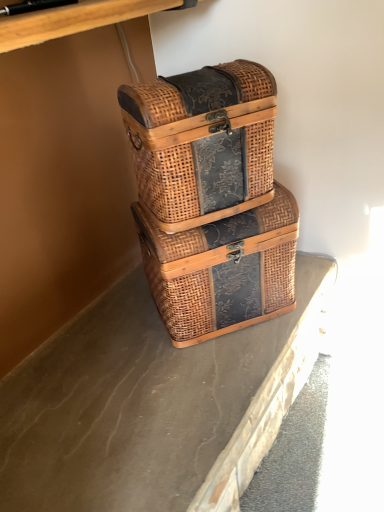
Question: Would you say woven wood picnic basket at center, which is the second picnic basket in bottom-to-top order, is outside brown textured concrete at center?

Choices:
 (A) yes
 (B) no

Answer: (A)

Question: From the image's perspective, is woven wood picnic basket at center, arranged as the first picnic basket when viewed from the top, located above brown textured concrete at center?

Choices:
 (A) no
 (B) yes

Answer: (B)

Question: Considering the relative sizes of woven wood picnic basket at center, which is the second picnic basket in bottom-to-top order, and brown textured concrete at center in the image provided, is woven wood picnic basket at center, which is the second picnic basket in bottom-to-top order, taller than brown textured concrete at center?

Choices:
 (A) yes
 (B) no

Answer: (A)

Question: Is the position of woven wood picnic basket at center, which is the second picnic basket in bottom-to-top order, less distant than that of brown textured concrete at center?

Choices:
 (A) no
 (B) yes

Answer: (A)

Question: Does woven wood picnic basket at center, arranged as the first picnic basket when viewed from the top, appear on the right side of brown textured concrete at center?

Choices:
 (A) no
 (B) yes

Answer: (B)

Question: From the image's perspective, is brown textured concrete at center located above or below woven brown picnic basket at center, which is the second picnic basket in top-to-bottom order?

Choices:
 (A) below
 (B) above

Answer: (A)

Question: From their relative heights in the image, would you say brown textured concrete at center is taller or shorter than woven brown picnic basket at center, which is the second picnic basket in top-to-bottom order?

Choices:
 (A) tall
 (B) short

Answer: (B)

Question: From a real-world perspective, is brown textured concrete at center above or below woven brown picnic basket at center, which is the second picnic basket in top-to-bottom order?

Choices:
 (A) below
 (B) above

Answer: (A)

Question: Which is correct: brown textured concrete at center is inside woven brown picnic basket at center, which is the second picnic basket in top-to-bottom order, or outside of it?

Choices:
 (A) inside
 (B) outside

Answer: (B)

Question: Looking at their shapes, would you say woven wood picnic basket at center, which is the second picnic basket in bottom-to-top order, is wider or thinner than brown textured concrete at center?

Choices:
 (A) wide
 (B) thin

Answer: (B)

Question: Is woven wood picnic basket at center, which is the second picnic basket in bottom-to-top order, taller or shorter than brown textured concrete at center?

Choices:
 (A) tall
 (B) short

Answer: (A)

Question: In terms of size, does woven wood picnic basket at center, which is the second picnic basket in bottom-to-top order, appear bigger or smaller than brown textured concrete at center?

Choices:
 (A) big
 (B) small

Answer: (A)

Question: Would you say woven wood picnic basket at center, which is the second picnic basket in bottom-to-top order, is to the left or to the right of brown textured concrete at center in the picture?

Choices:
 (A) left
 (B) right

Answer: (B)

Question: Looking at their shapes, would you say brown textured concrete at center is wider or thinner than woven wood picnic basket at center, arranged as the first picnic basket when viewed from the top?

Choices:
 (A) wide
 (B) thin

Answer: (A)

Question: Which is correct: brown textured concrete at center is inside woven wood picnic basket at center, arranged as the first picnic basket when viewed from the top, or outside of it?

Choices:
 (A) inside
 (B) outside

Answer: (B)